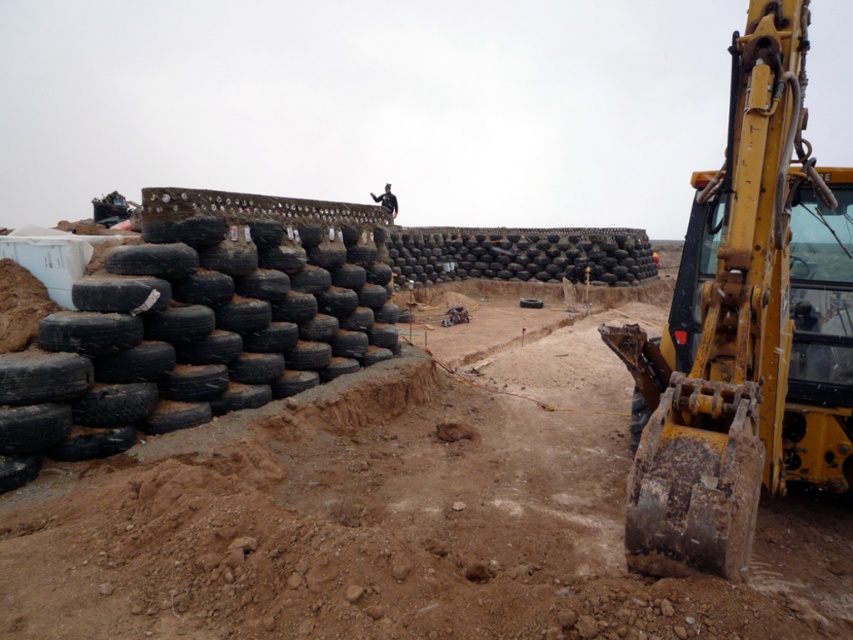
Consider the image. You are a construction worker standing at the edge of the construction site. You need to move a heavy tool from your current position to the yellow metallic excavator at right. Given that the shortest path between you and the excavator is 3.27 meters, and your tool weighs 20 kilograms, can you safely carry it without needing assistance?

The distance between you and the yellow metallic excavator at right is 3.27 meters. Since the tool weighs 20 kilograms, which is within a manageable range for a single person over this short distance, you can safely carry it without needing assistance.

You are a safety inspector at the construction site. You notice the yellow metallic excavator at right and the black matte construction worker at upper center. Which object is positioned to the right side of the other?

The yellow metallic excavator at right is to the right of the black matte construction worker at upper center.

You are a construction worker needing to move a heavy equipment part from the yellow metallic excavator at right to the black rubber tires at left. The part is 15 feet long. Can you safely transport it without needing to adjust the equipment or the tires?

The yellow metallic excavator at right is 15.18 feet from the black rubber tires at left. Since the part is 15 feet long, it can be safely transported as the distance between them is slightly longer than the part, allowing for safe handling without adjustments.